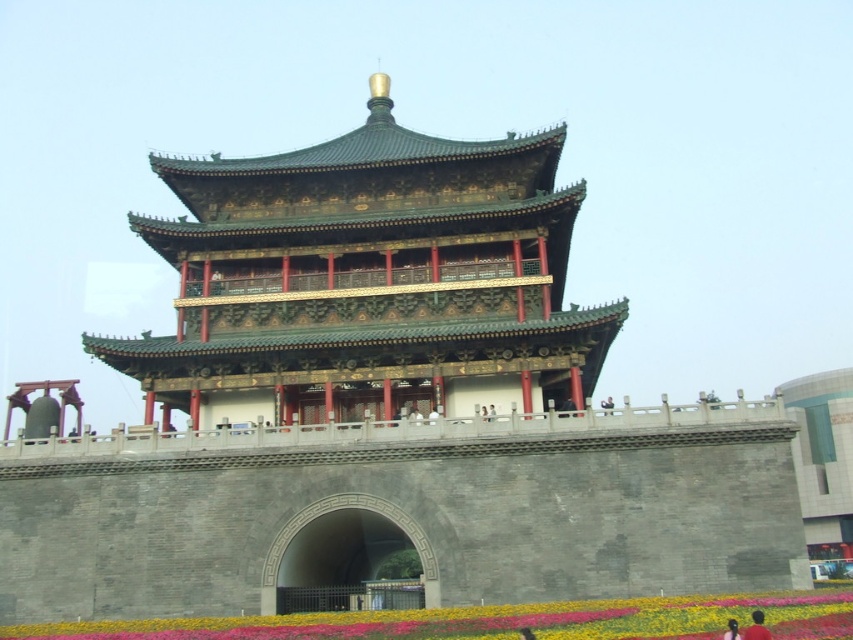
Question: Observing the image, what is the correct spatial positioning of green glazed tile tower at center in reference to dark brown hair at lower right?

Choices:
 (A) right
 (B) left

Answer: (B)

Question: Estimate the real-world distances between objects in this image. Which object is closer to the green glazed tile tower at center?

Choices:
 (A) vibrant floral carpet at lower center
 (B) dark brown hair at lower right

Answer: (A)

Question: Can you confirm if vibrant floral carpet at lower center is thinner than dark brown hair at lower right?

Choices:
 (A) yes
 (B) no

Answer: (B)

Question: Which point appears farthest from the camera in this image?

Choices:
 (A) (579, 632)
 (B) (747, 628)

Answer: (A)

Question: Which point is farther from the camera taking this photo?

Choices:
 (A) (747, 628)
 (B) (454, 305)
 (C) (151, 628)

Answer: (B)

Question: Can you confirm if green glazed tile tower at center is positioned to the right of vibrant floral carpet at lower center?

Choices:
 (A) yes
 (B) no

Answer: (B)